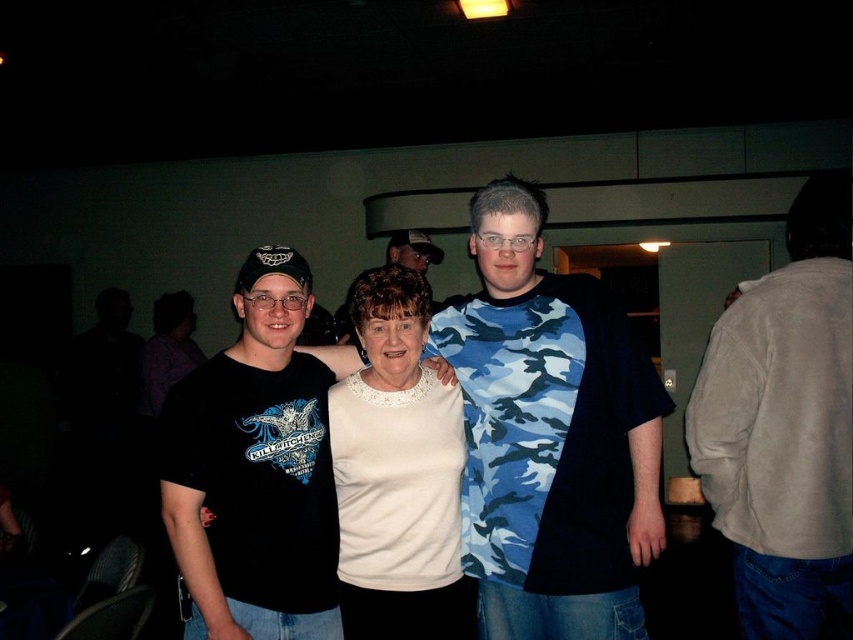
Question: Which object appears farthest from the camera in this image?

Choices:
 (A) black matte t-shirt at left
 (B) white lace sweater at center
 (C) blue camouflage shirt at center

Answer: (B)

Question: Is the position of blue camouflage shirt at center more distant than that of white lace sweater at center?

Choices:
 (A) no
 (B) yes

Answer: (A)

Question: Is blue camouflage shirt at center smaller than white fleece jacket at right?

Choices:
 (A) no
 (B) yes

Answer: (B)

Question: Can you confirm if white fleece jacket at right is wider than camouflage t-shirt at center?

Choices:
 (A) yes
 (B) no

Answer: (A)

Question: Considering the real-world distances, which object is farthest from the white fleece jacket at right?

Choices:
 (A) white lace sweater at center
 (B) camouflage t-shirt at center
 (C) blue camouflage shirt at center

Answer: (B)

Question: Based on their relative distances, which object is nearer to the black matte t-shirt at left?

Choices:
 (A) camouflage t-shirt at center
 (B) white lace sweater at center
 (C) blue camouflage shirt at center
 (D) white fleece jacket at right

Answer: (B)